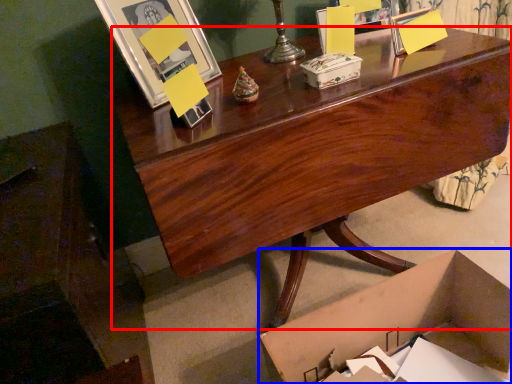
Question: Which of the following is the closest to the observer, desk (highlighted by a red box) or box (highlighted by a blue box)?

Choices:
 (A) desk
 (B) box

Answer: (B)